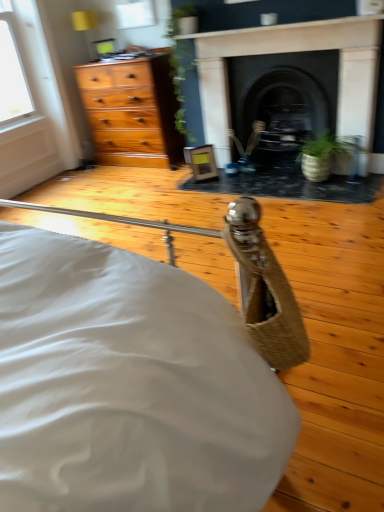
Question: Is green textured pot at center to the left or to the right of transparent glass window at upper center in the image?

Choices:
 (A) left
 (B) right

Answer: (B)

Question: Is green textured pot at center in front of or behind transparent glass window at upper center in the image?

Choices:
 (A) front
 (B) behind

Answer: (A)

Question: Which of these objects is positioned farthest from the dark stone fireplace at center, marked as the first fireplace in a left-to-right arrangement?

Choices:
 (A) transparent glass window at upper center
 (B) black stone fireplace at center, which appears as the first fireplace when viewed from the right
 (C) green textured pot at center

Answer: (A)

Question: Which is farther from the dark stone fireplace at center, marked as the first fireplace in a left-to-right arrangement?

Choices:
 (A) black stone fireplace at center, which is the second fireplace in left-to-right order
 (B) green textured pot at center
 (C) transparent glass window at upper center

Answer: (C)